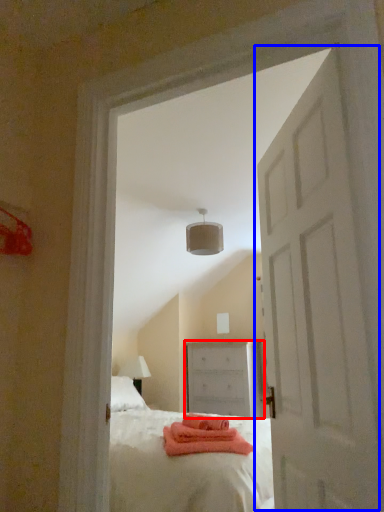
Question: Which point is further to the camera, chest of drawers (highlighted by a red box) or door (highlighted by a blue box)?

Choices:
 (A) chest of drawers
 (B) door

Answer: (A)